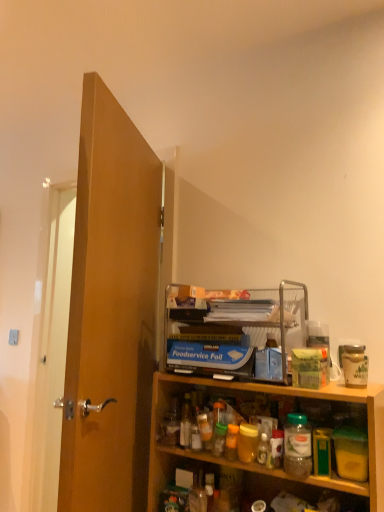
Question: From a real-world perspective, is blue cardboard foodservice foil at upper center located beneath wooden door at left?

Choices:
 (A) no
 (B) yes

Answer: (B)

Question: Is blue cardboard foodservice foil at upper center to the left of wooden door at left from the viewer's perspective?

Choices:
 (A) yes
 (B) no

Answer: (B)

Question: Does blue cardboard foodservice foil at upper center have a greater width compared to wooden door at left?

Choices:
 (A) yes
 (B) no

Answer: (A)

Question: Is blue cardboard foodservice foil at upper center aimed at wooden door at left?

Choices:
 (A) yes
 (B) no

Answer: (B)

Question: Considering the relative sizes of blue cardboard foodservice foil at upper center and wooden door at left in the image provided, is blue cardboard foodservice foil at upper center taller than wooden door at left?

Choices:
 (A) no
 (B) yes

Answer: (A)

Question: Does blue cardboard foodservice foil at upper center contain wooden door at left?

Choices:
 (A) no
 (B) yes

Answer: (A)

Question: Is blue cardboard foodservice foil at upper center behind wooden cabinet at lower right?

Choices:
 (A) no
 (B) yes

Answer: (B)

Question: Is blue cardboard foodservice foil at upper center in contact with wooden cabinet at lower right?

Choices:
 (A) no
 (B) yes

Answer: (A)

Question: Is blue cardboard foodservice foil at upper center not inside wooden cabinet at lower right?

Choices:
 (A) yes
 (B) no

Answer: (A)

Question: From a real-world perspective, is blue cardboard foodservice foil at upper center positioned under wooden cabinet at lower right based on gravity?

Choices:
 (A) yes
 (B) no

Answer: (B)

Question: Is blue cardboard foodservice foil at upper center to the right of wooden cabinet at lower right from the viewer's perspective?

Choices:
 (A) yes
 (B) no

Answer: (B)

Question: Is blue cardboard foodservice foil at upper center positioned with its back to wooden cabinet at lower right?

Choices:
 (A) yes
 (B) no

Answer: (B)

Question: From the image's perspective, would you say wooden door at left is positioned over blue cardboard foodservice foil at upper center?

Choices:
 (A) no
 (B) yes

Answer: (B)